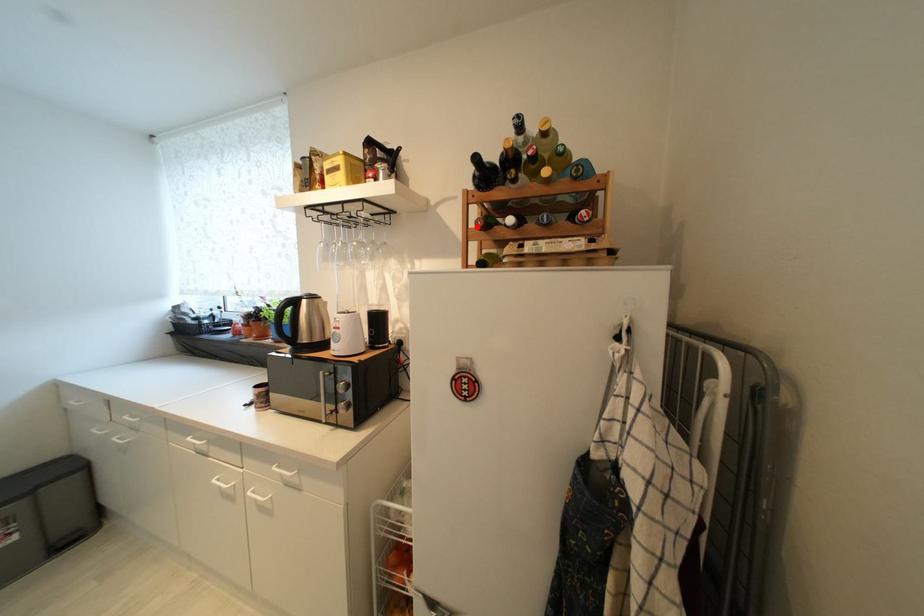
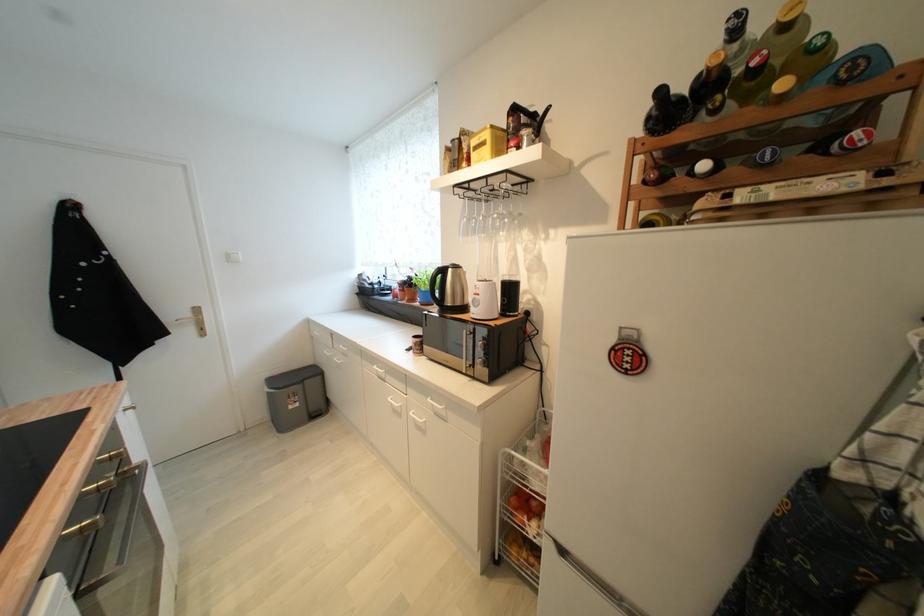
The point at the highlighted location is marked in the first image. Where is the corresponding point in the second image?

(641, 182)